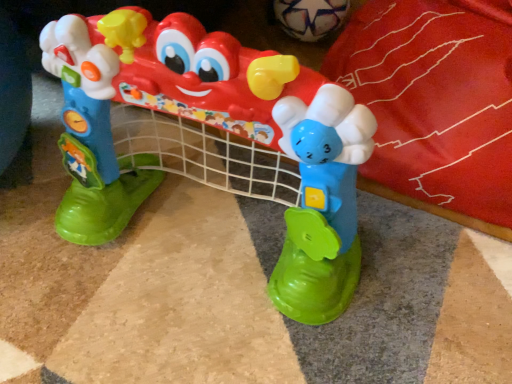
Question: Is white matte soccer ball at upper center, the first toy in the top-to-bottom sequence, with plastic toy at center, the first toy in the front-to-back sequence?

Choices:
 (A) yes
 (B) no

Answer: (B)

Question: Is white matte soccer ball at upper center, the 2th toy positioned from the bottom, facing towards plastic toy at center, which is the first toy in bottom-to-top order?

Choices:
 (A) yes
 (B) no

Answer: (A)

Question: Is plastic toy at center, which is the first toy in bottom-to-top order, located within white matte soccer ball at upper center, the first toy in the top-to-bottom sequence?

Choices:
 (A) yes
 (B) no

Answer: (B)

Question: Is white matte soccer ball at upper center, the first toy positioned from the back, to the left of plastic toy at center, which is the 2th toy in back-to-front order, from the viewer's perspective?

Choices:
 (A) yes
 (B) no

Answer: (B)

Question: Is white matte soccer ball at upper center, the first toy positioned from the back, to the right of plastic toy at center, which ranks as the second toy in top-to-bottom order, from the viewer's perspective?

Choices:
 (A) no
 (B) yes

Answer: (B)

Question: Does white matte soccer ball at upper center, the 2th toy in the front-to-back sequence, have a smaller size compared to plastic toy at center, which is the first toy in bottom-to-top order?

Choices:
 (A) no
 (B) yes

Answer: (B)

Question: Is there a large distance between plastic toy at center, which ranks as the second toy in top-to-bottom order, and white matte soccer ball at upper center, the 2th toy in the front-to-back sequence?

Choices:
 (A) yes
 (B) no

Answer: (B)

Question: Considering the relative sizes of plastic toy at center, which is the 2th toy in back-to-front order, and white matte soccer ball at upper center, the first toy positioned from the back, in the image provided, is plastic toy at center, which is the 2th toy in back-to-front order, bigger than white matte soccer ball at upper center, the first toy positioned from the back,?

Choices:
 (A) no
 (B) yes

Answer: (B)

Question: Is plastic toy at center, which is the first toy in bottom-to-top order, shorter than white matte soccer ball at upper center, the first toy in the top-to-bottom sequence?

Choices:
 (A) no
 (B) yes

Answer: (A)

Question: Does plastic toy at center, the first toy in the front-to-back sequence, have a smaller size compared to white matte soccer ball at upper center, the 2th toy in the front-to-back sequence?

Choices:
 (A) yes
 (B) no

Answer: (B)

Question: Is white matte soccer ball at upper center, the 2th toy in the front-to-back sequence, inside plastic toy at center, the first toy in the front-to-back sequence?

Choices:
 (A) yes
 (B) no

Answer: (B)

Question: Can you confirm if plastic toy at center, which ranks as the second toy in top-to-bottom order, is positioned to the left of white matte soccer ball at upper center, the 2th toy in the front-to-back sequence?

Choices:
 (A) no
 (B) yes

Answer: (B)

Question: Is white matte soccer ball at upper center, the 2th toy positioned from the bottom, in front of or behind plastic toy at center, which is the first toy in bottom-to-top order, in the image?

Choices:
 (A) front
 (B) behind

Answer: (B)